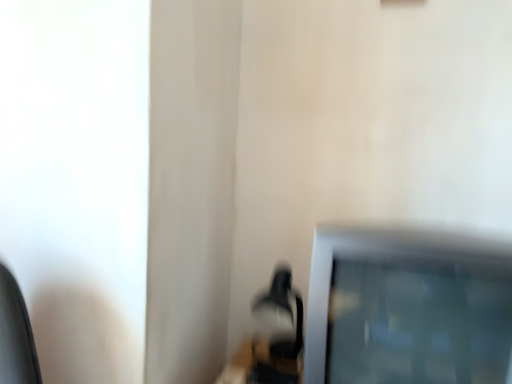
Question: Can you confirm if matte black table lamp at lower center is wider than satin silver television at lower right?

Choices:
 (A) no
 (B) yes

Answer: (A)

Question: Can you confirm if matte black table lamp at lower center is shorter than satin silver television at lower right?

Choices:
 (A) no
 (B) yes

Answer: (B)

Question: Is satin silver television at lower right at the back of matte black table lamp at lower center?

Choices:
 (A) no
 (B) yes

Answer: (A)

Question: Considering the relative sizes of matte black table lamp at lower center and satin silver television at lower right in the image provided, is matte black table lamp at lower center smaller than satin silver television at lower right?

Choices:
 (A) no
 (B) yes

Answer: (B)

Question: From the image's perspective, would you say matte black table lamp at lower center is shown under satin silver television at lower right?

Choices:
 (A) no
 (B) yes

Answer: (B)

Question: Can we say matte black table lamp at lower center lies outside satin silver television at lower right?

Choices:
 (A) yes
 (B) no

Answer: (A)

Question: From a real-world perspective, is satin silver television at lower right physically below matte black table lamp at lower center?

Choices:
 (A) no
 (B) yes

Answer: (A)

Question: Considering the relative positions of satin silver television at lower right and matte black table lamp at lower center in the image provided, is satin silver television at lower right to the right of matte black table lamp at lower center from the viewer's perspective?

Choices:
 (A) no
 (B) yes

Answer: (B)

Question: Is the depth of satin silver television at lower right greater than that of matte black table lamp at lower center?

Choices:
 (A) yes
 (B) no

Answer: (B)

Question: From the image's perspective, would you say satin silver television at lower right is positioned over matte black table lamp at lower center?

Choices:
 (A) yes
 (B) no

Answer: (A)

Question: Does satin silver television at lower right turn towards matte black table lamp at lower center?

Choices:
 (A) yes
 (B) no

Answer: (B)

Question: Is satin silver television at lower right in front of matte black table lamp at lower center?

Choices:
 (A) yes
 (B) no

Answer: (A)

Question: Looking at their shapes, would you say matte black table lamp at lower center is wider or thinner than satin silver television at lower right?

Choices:
 (A) wide
 (B) thin

Answer: (B)